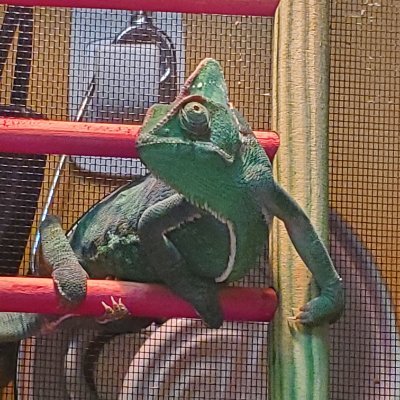
I want to click on wall, so click(264, 33).